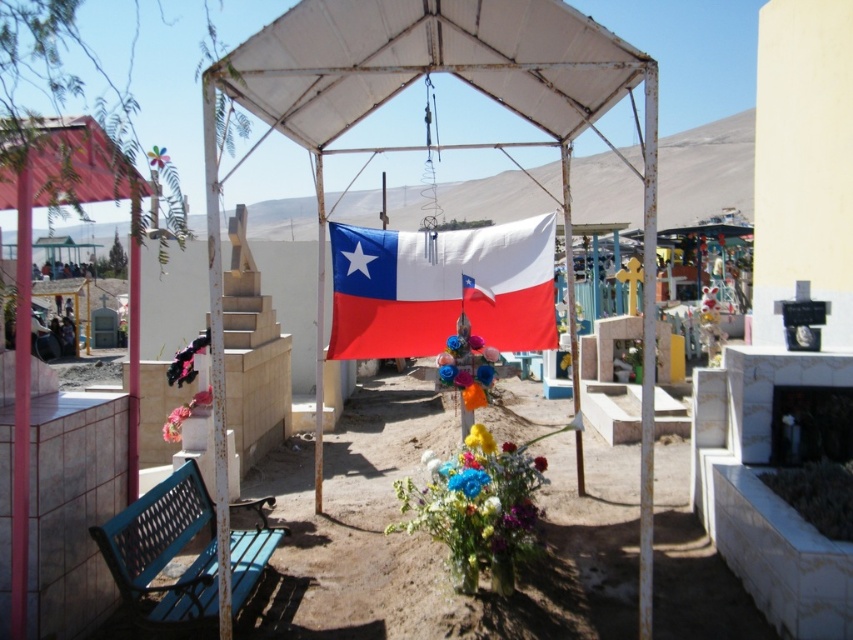
Question: Can you confirm if yellow fabric flower at center is smaller than matte plastic flower at center?

Choices:
 (A) no
 (B) yes

Answer: (B)

Question: Which of the following is the closest to the observer?

Choices:
 (A) blue painted metal bench at lower left
 (B) pink fabric flower at lower left
 (C) yellow fabric flower at center
 (D) matte plastic flower at center

Answer: (A)

Question: Which of the following is the farthest from the observer?

Choices:
 (A) matte black vase at lower left
 (B) multicolored fabric flowers at center
 (C) fluffy bouquet at center
 (D) blue painted metal bench at lower left

Answer: (A)

Question: Can you confirm if yellow fabric flower at center is positioned above matte plastic flower at center?

Choices:
 (A) no
 (B) yes

Answer: (A)

Question: Which object is positioned farthest from the fluffy fabric flower at center?

Choices:
 (A) yellow fabric flower at center
 (B) pink fabric flower at lower left

Answer: (B)

Question: Does multicolored fabric flowers at center lie in front of fluffy fabric flower at center?

Choices:
 (A) yes
 (B) no

Answer: (A)